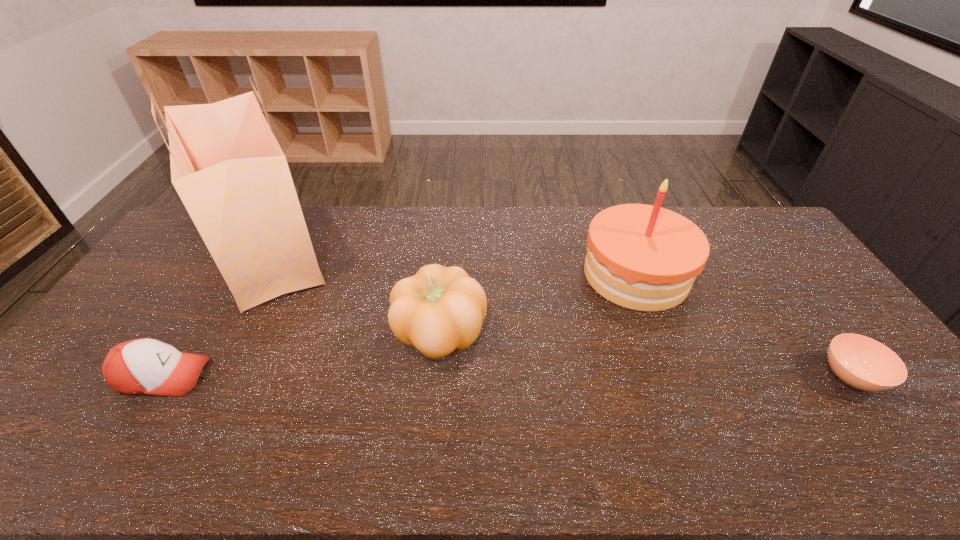
The width and height of the screenshot is (960, 540). What are the coordinates of `vacant region located on the right of the third object from right to left` in the screenshot? It's located at (532, 333).

This screenshot has height=540, width=960. I want to click on vacant space located on the front-facing side of the fourth tallest object, so click(x=331, y=376).

Locate an element on the screen. This screenshot has height=540, width=960. free location located 0.050m on the left of the shortest object is located at coordinates (801, 377).

Where is `grocery bag located at the far edge`? This screenshot has height=540, width=960. grocery bag located at the far edge is located at coordinates (227, 167).

Identify the location of birthday cake located in the far edge section of the desktop. This screenshot has width=960, height=540. (642, 257).

Locate an element on the screen. This screenshot has height=540, width=960. grocery bag that is at the left edge is located at coordinates (227, 167).

The image size is (960, 540). Identify the location of baseball cap that is positioned at the left edge. (141, 366).

Identify the location of object located at the right edge. The height and width of the screenshot is (540, 960). (861, 362).

What are the coordinates of `object situated at the far left corner` in the screenshot? It's located at (227, 167).

This screenshot has height=540, width=960. In order to click on free space at the far edge in this screenshot , I will do `click(372, 212)`.